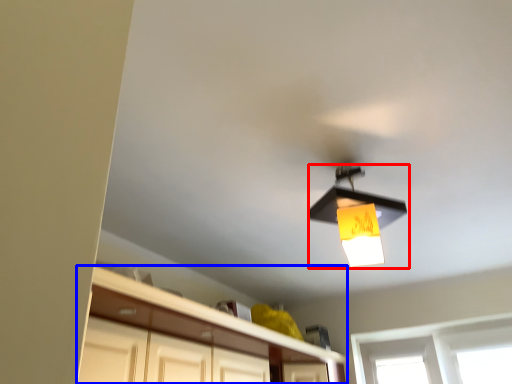
Question: Among these objects, which one is farthest to the camera, lamp (highlighted by a red box) or cabinetry (highlighted by a blue box)?

Choices:
 (A) lamp
 (B) cabinetry

Answer: (A)